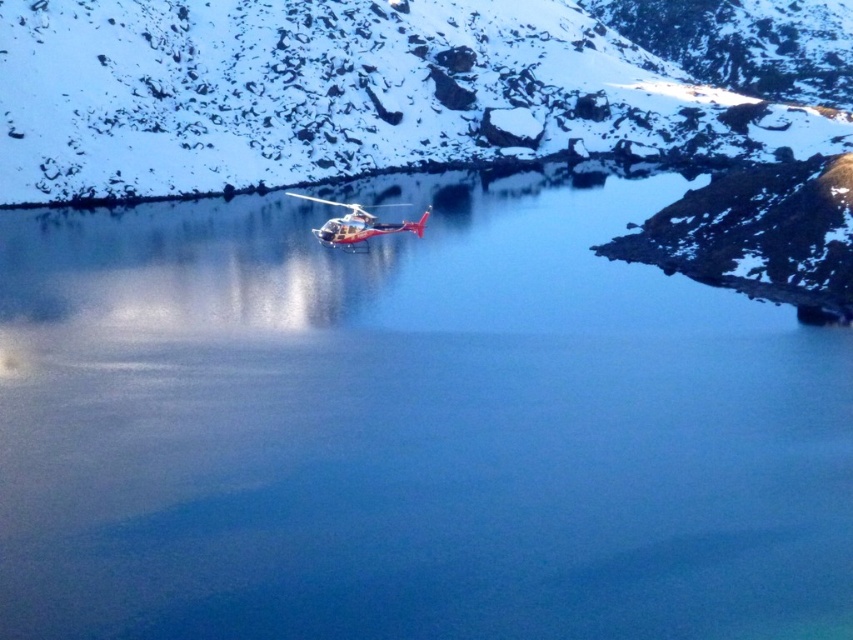
Is matte white mountain at center behind metallic silver helicopter at center?

No, it is not.

Does point (659, 3) come farther from viewer compared to point (357, 230)?

Yes, point (659, 3) is farther from viewer.

Where is `matte white mountain at center`? This screenshot has height=640, width=853. matte white mountain at center is located at coordinates (381, 90).